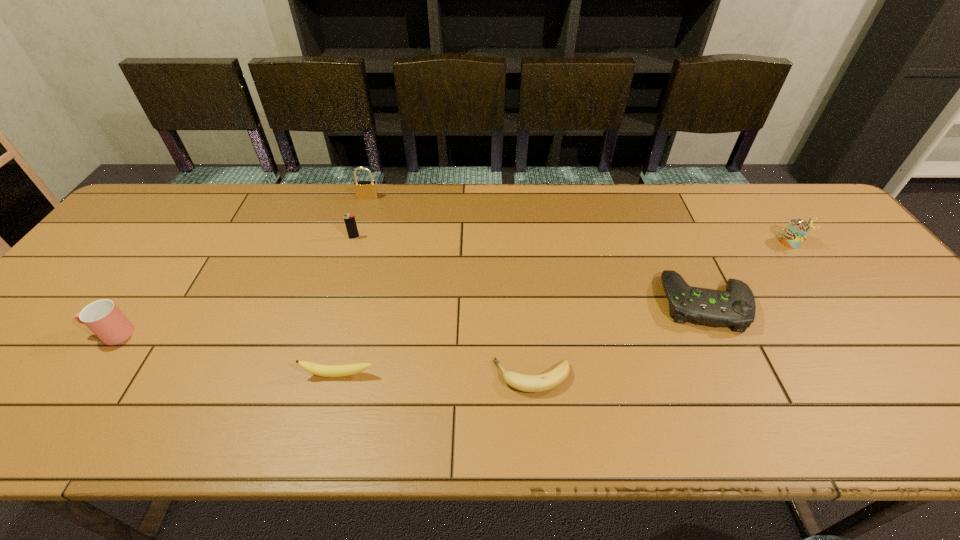
What are the coordinates of `vacant region at the near edge of the desktop` in the screenshot? It's located at (747, 402).

This screenshot has width=960, height=540. I want to click on vacant space at the left edge of the desktop, so click(66, 338).

Where is `vacant point at the right edge`? This screenshot has width=960, height=540. vacant point at the right edge is located at coordinates (880, 307).

What are the coordinates of `vacant point at the far left corner` in the screenshot? It's located at (140, 223).

Where is `free point between the cup and the rightmost object`? The width and height of the screenshot is (960, 540). free point between the cup and the rightmost object is located at coordinates (452, 288).

Find the location of a particular element. This screenshot has width=960, height=540. free spot between the igniter and the padlock is located at coordinates (361, 218).

You are a GUI agent. You are given a task and a screenshot of the screen. Output one action in this format:
    pyautogui.click(x=<x>, y=<y>)
    Task: Click on the free point between the second object from right to left and the rightmost object
    Image resolution: width=960 pixels, height=540 pixels.
    Given the screenshot: What is the action you would take?
    pyautogui.click(x=748, y=273)

Where is `vacant point located between the second object from right to left and the can`? The image size is (960, 540). vacant point located between the second object from right to left and the can is located at coordinates (748, 273).

Find the location of a particular element. empty location between the taller banana and the second object from right to left is located at coordinates (522, 339).

This screenshot has height=540, width=960. I want to click on empty space that is in between the can and the leftmost object, so click(452, 288).